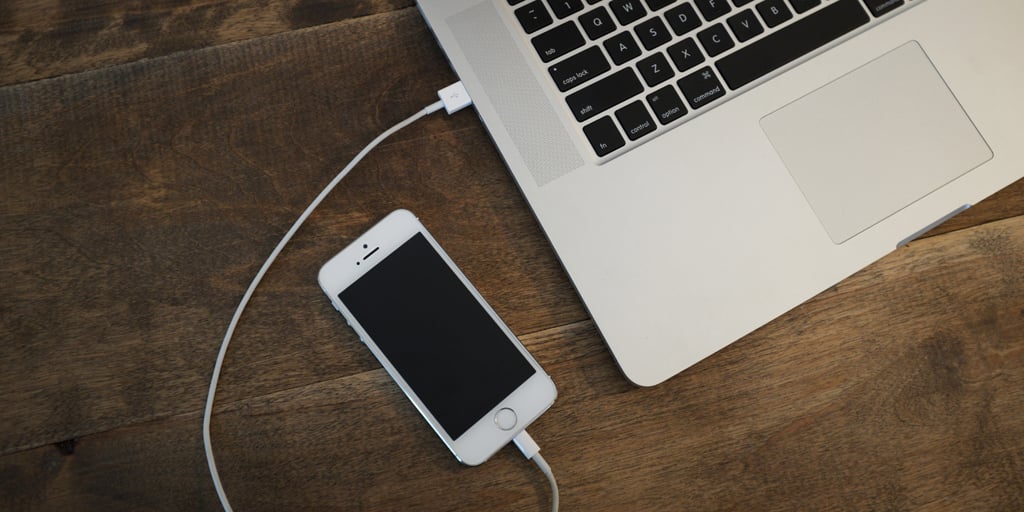
Identify the location of woodgrain surface. (274, 100), (895, 376).